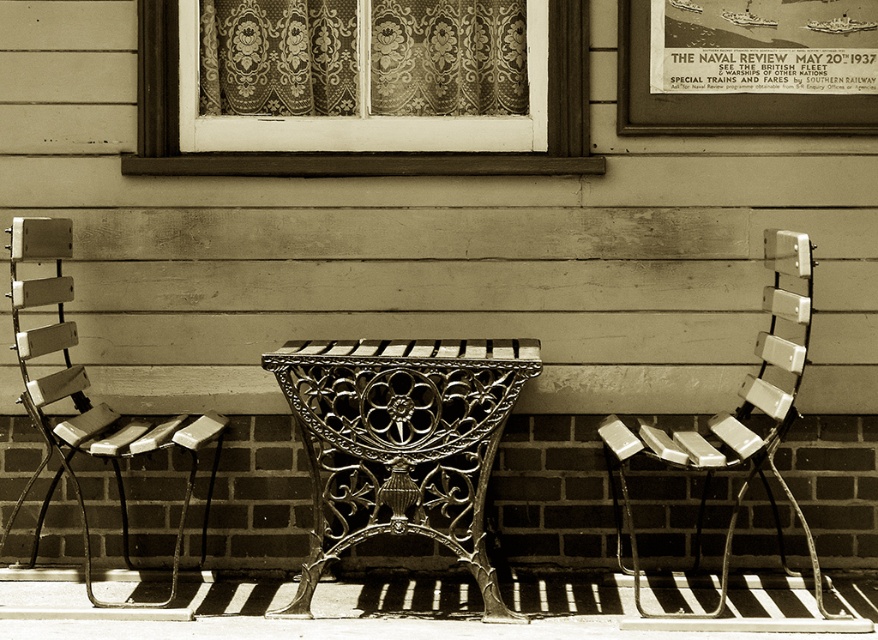
You are standing in the vintage scene and want to know how far you are from the point marked at coordinates point (779, 296). Can you determine the distance?

The point marked at coordinates point (779, 296) is 5.51 meters away from your current position.

You are standing in the vintage room and want to move from the first point to the second point. Can you walk directly from point [68,282] to point [781,420] without any obstacles?

Point [68,282] is behind point [781,420], so you cannot walk directly between them because the second point is blocking the path.

You are standing at the center of the room and see a point marked at coordinates (83, 394). What object is located at that point?

The point at coordinates (83, 394) is occupied by the matte wood chair at left.